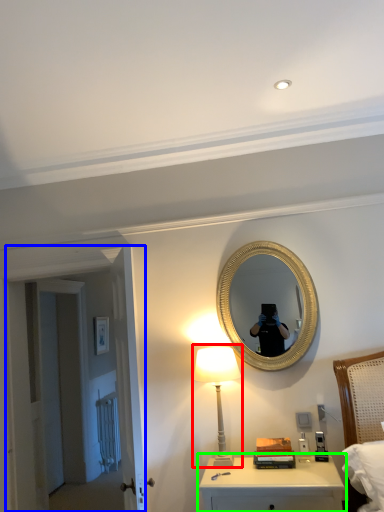
Question: Which object is positioned farthest from table lamp (highlighted by a red box)? Select from door (highlighted by a blue box) and nightstand (highlighted by a green box).

Choices:
 (A) door
 (B) nightstand

Answer: (A)